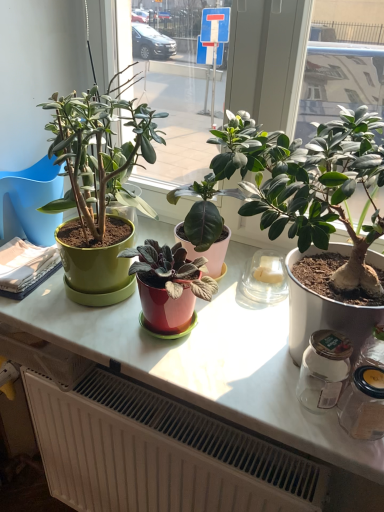
Question: Does green matte plant pot at left, marked as the 2th houseplant in a right-to-left arrangement, turn towards matte green plant at center, the 1th houseplant viewed from the right?

Choices:
 (A) yes
 (B) no

Answer: (B)

Question: Is green matte plant pot at left, marked as the 2th houseplant in a right-to-left arrangement, far from matte green plant at center, the 1th houseplant viewed from the right?

Choices:
 (A) yes
 (B) no

Answer: (B)

Question: Is green matte plant pot at left, which is counted as the 1th houseplant, starting from the left, at the right side of matte green plant at center, arranged as the second houseplant when viewed from the left?

Choices:
 (A) no
 (B) yes

Answer: (A)

Question: From the image's perspective, is green matte plant pot at left, marked as the 2th houseplant in a right-to-left arrangement, located above matte green plant at center, the 1th houseplant viewed from the right?

Choices:
 (A) no
 (B) yes

Answer: (B)

Question: Is green matte plant pot at left, which is counted as the 1th houseplant, starting from the left, positioned in front of matte green plant at center, arranged as the second houseplant when viewed from the left?

Choices:
 (A) no
 (B) yes

Answer: (A)

Question: Looking at their shapes, would you say white matte radiator at lower center is wider or thinner than matte green pot at left?

Choices:
 (A) wide
 (B) thin

Answer: (B)

Question: From the image's perspective, is white matte radiator at lower center located above or below matte green pot at left?

Choices:
 (A) below
 (B) above

Answer: (A)

Question: Is point (167, 424) positioned closer to the camera than point (39, 160)?

Choices:
 (A) farther
 (B) closer

Answer: (B)

Question: From a real-world perspective, is white matte radiator at lower center positioned above or below matte green pot at left?

Choices:
 (A) above
 (B) below

Answer: (B)

Question: From the image's perspective, is green matte plant pot at left, marked as the 2th houseplant in a right-to-left arrangement, located above or below matte green plant at center, arranged as the second houseplant when viewed from the left?

Choices:
 (A) below
 (B) above

Answer: (B)

Question: Does point (119, 174) appear closer or farther from the camera than point (301, 198)?

Choices:
 (A) farther
 (B) closer

Answer: (A)

Question: Considering their positions, is green matte plant pot at left, marked as the 2th houseplant in a right-to-left arrangement, located in front of or behind matte green plant at center, the 1th houseplant viewed from the right?

Choices:
 (A) behind
 (B) front

Answer: (A)

Question: Would you say green matte plant pot at left, which is counted as the 1th houseplant, starting from the left, is to the left or to the right of matte green plant at center, arranged as the second houseplant when viewed from the left, in the picture?

Choices:
 (A) right
 (B) left

Answer: (B)

Question: From their relative heights in the image, would you say matte green plant at center, the 1th houseplant viewed from the right, is taller or shorter than green matte plant pot at left, which is counted as the 1th houseplant, starting from the left?

Choices:
 (A) tall
 (B) short

Answer: (A)

Question: Is matte green plant at center, the 1th houseplant viewed from the right, in front of or behind green matte plant pot at left, marked as the 2th houseplant in a right-to-left arrangement, in the image?

Choices:
 (A) behind
 (B) front

Answer: (B)